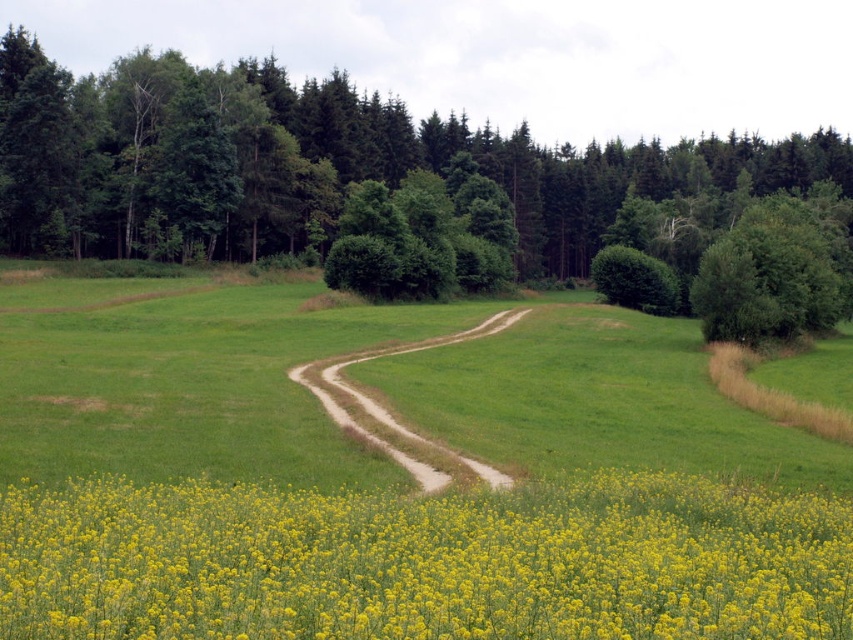
Looking at this image, you are a hiker standing at the bottom left of the dirt path. You want to reach the green leafy bush at upper right without stepping on the green leafy tree at center. Is it possible?

The green leafy tree at center is positioned over the green leafy bush at upper right, so you cannot reach the green leafy bush at upper right without stepping on the green leafy tree at center.

From the picture: You are a hiker planning to take the brown dirt trail at center through the green leafy tree at center. Can you walk under the tree without bending down?

The green leafy tree at center is much taller than the brown dirt trail at center, so yes, you can walk under the tree without bending down because the tree is significantly taller than the trail, providing ample clearance.